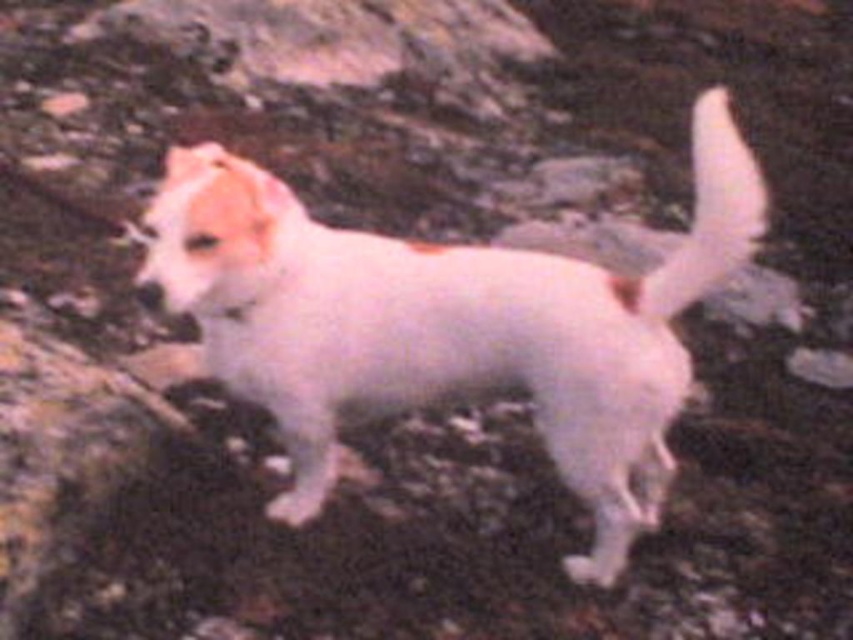
In the scene shown: You are a photographer trying to capture the perfect shot of the dog. You notice two points marked in the image. One is at point (509, 320) and the other at point (701, 148). Which point is closer to the camera?

Point (701, 148) is closer to the camera because point (509, 320) is behind it.

You are a photographer trying to capture a picture of the white fluffy dog at center and the white fluffy tail at upper right. Which object should you focus on first if you want to capture both in the same frame without moving the camera?

You should focus on the white fluffy dog at center first because it is closer to the camera than the white fluffy tail at upper right, allowing both to be in focus when using a proper depth of field.

You are a photographer trying to capture the white fluffy dog at center and the white fluffy tail at upper right in a single frame. Based on their sizes, which one will occupy more space in the photo?

The white fluffy dog at center will occupy more space in the photo because its width surpasses that of the white fluffy tail at upper right.